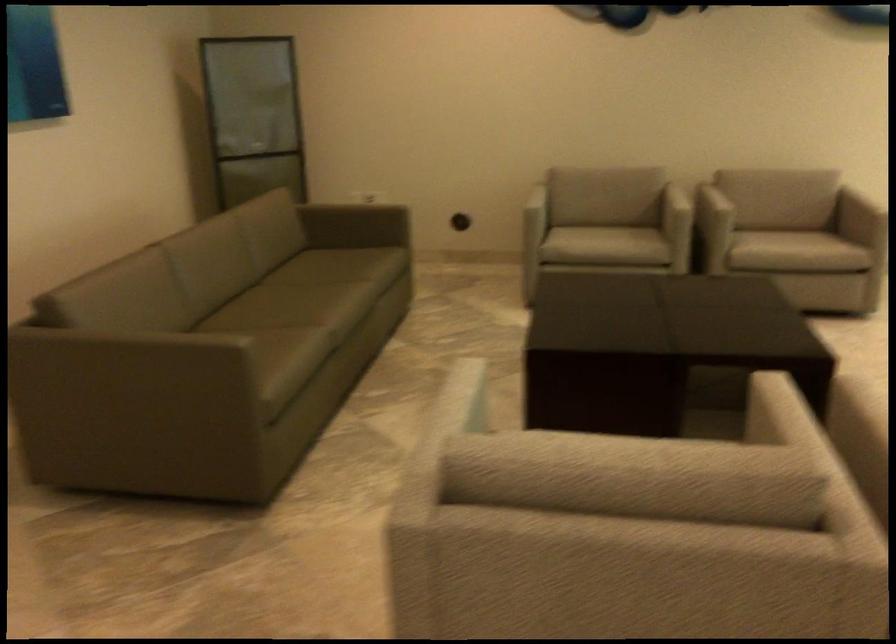
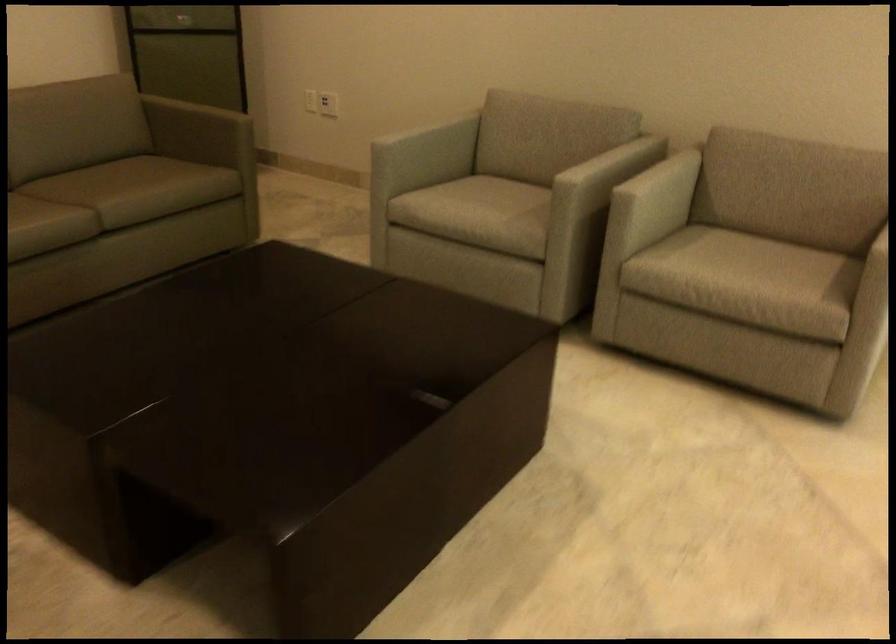
Locate, in the second image, the point that corresponds to point 642,187 in the first image.

(588, 149)